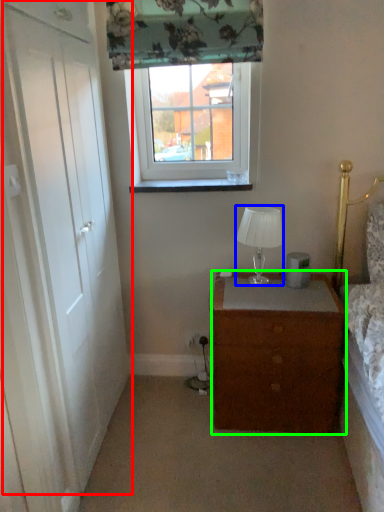
Question: Based on their relative distances, which object is nearer to door (highlighted by a red box)? Choose from lamp (highlighted by a blue box) and chest of drawers (highlighted by a green box).

Choices:
 (A) lamp
 (B) chest of drawers

Answer: (B)